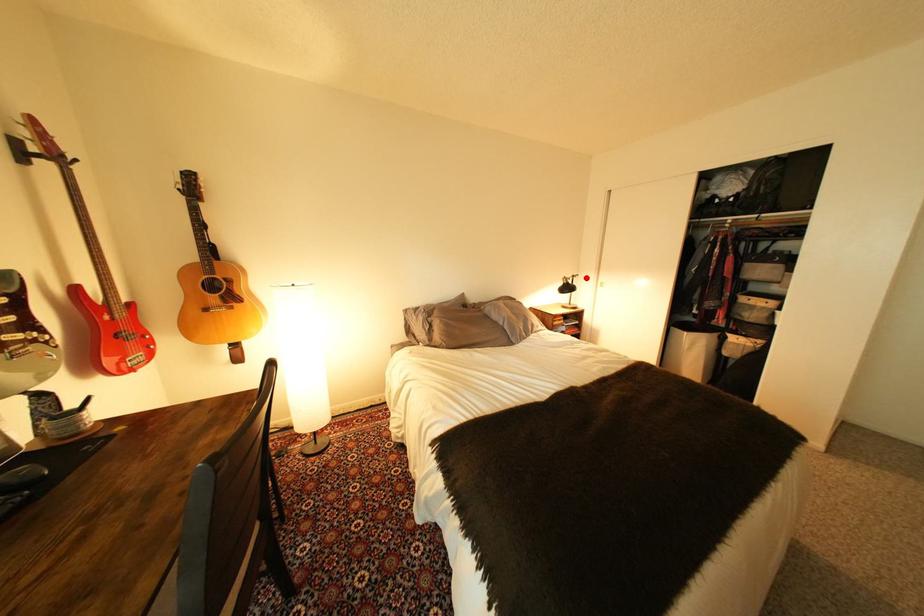
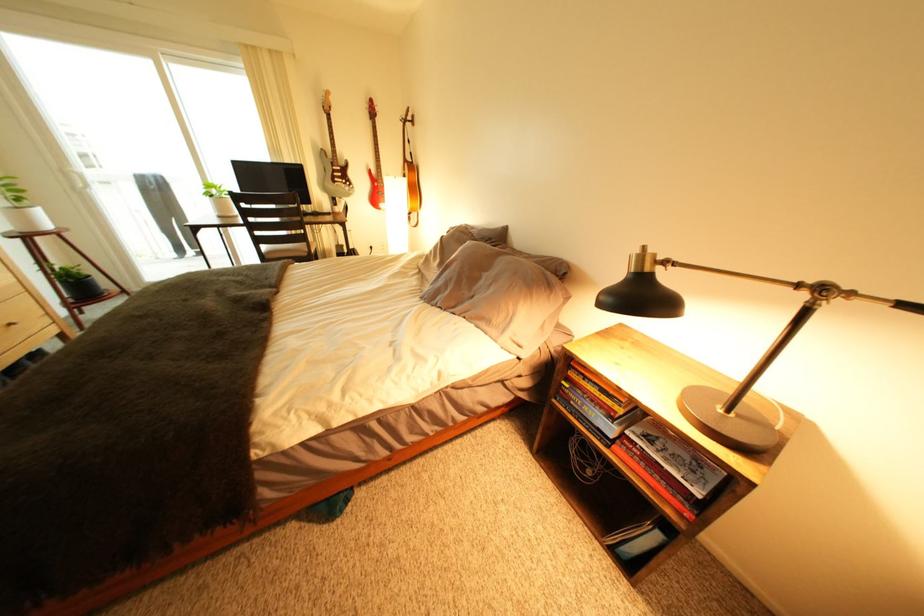
Locate, in the second image, the point that corresponds to the highlighted location in the first image.

(834, 291)